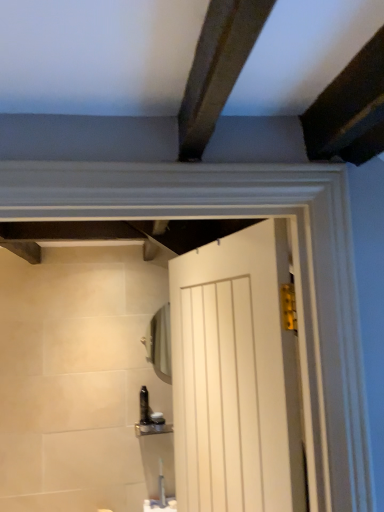
Question: Is clear glass mirror at upper center directly adjacent to white matte door at center?

Choices:
 (A) no
 (B) yes

Answer: (A)

Question: Considering the relative sizes of clear glass mirror at upper center and white matte door at center in the image provided, is clear glass mirror at upper center thinner than white matte door at center?

Choices:
 (A) no
 (B) yes

Answer: (B)

Question: Does clear glass mirror at upper center appear on the left side of white matte door at center?

Choices:
 (A) yes
 (B) no

Answer: (A)

Question: Is clear glass mirror at upper center outside white matte door at center?

Choices:
 (A) yes
 (B) no

Answer: (A)

Question: Would you consider clear glass mirror at upper center to be distant from white matte door at center?

Choices:
 (A) yes
 (B) no

Answer: (B)

Question: Can you confirm if clear glass mirror at upper center is smaller than white matte door at center?

Choices:
 (A) no
 (B) yes

Answer: (B)

Question: Can you confirm if white matte door at center is positioned to the left of clear glass mirror at upper center?

Choices:
 (A) no
 (B) yes

Answer: (A)

Question: Is white matte door at center placed right next to clear glass mirror at upper center?

Choices:
 (A) yes
 (B) no

Answer: (B)

Question: From a real-world perspective, is white matte door at center on top of clear glass mirror at upper center?

Choices:
 (A) no
 (B) yes

Answer: (A)

Question: Considering the relative sizes of white matte door at center and clear glass mirror at upper center in the image provided, is white matte door at center smaller than clear glass mirror at upper center?

Choices:
 (A) yes
 (B) no

Answer: (B)

Question: Is clear glass mirror at upper center surrounded by white matte door at center?

Choices:
 (A) no
 (B) yes

Answer: (A)

Question: Is white matte door at center wider than clear glass mirror at upper center?

Choices:
 (A) yes
 (B) no

Answer: (A)

Question: Is white matte door at center taller or shorter than clear glass mirror at upper center?

Choices:
 (A) tall
 (B) short

Answer: (A)